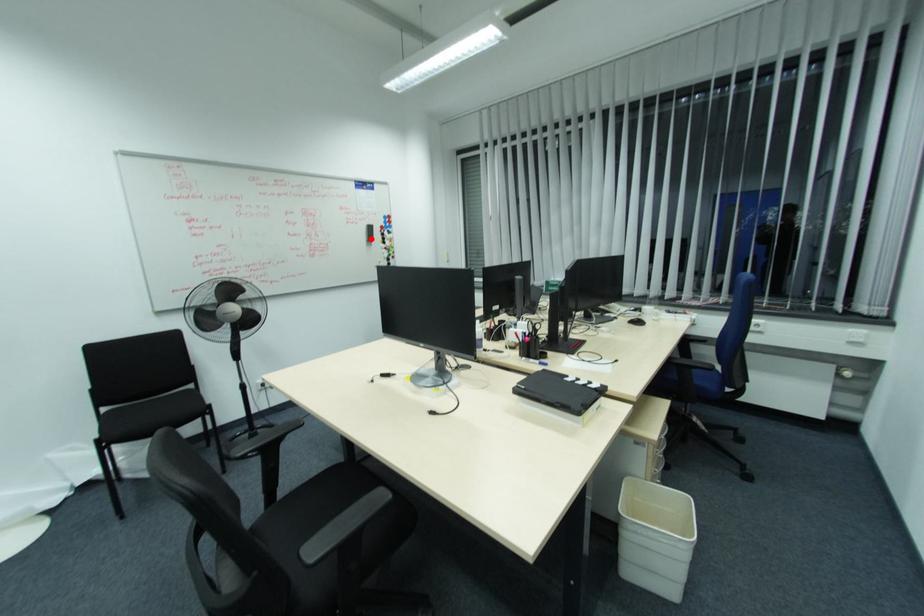
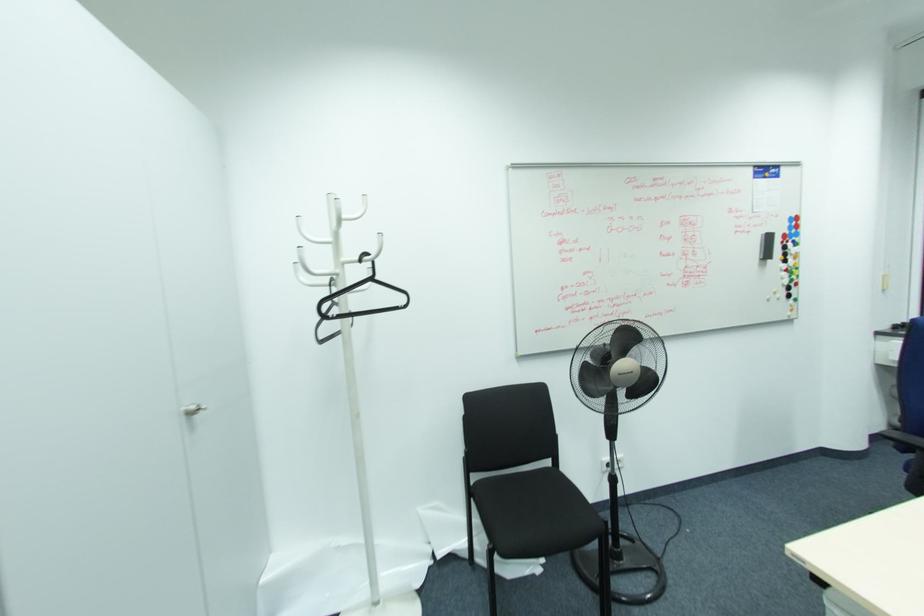
Question: I am providing you with two images of the same scene from different viewpoints. Image1 has a red point marked. In image2, the corresponding 3D location appears at what relative position? Reply with the corresponding letter.

Choices:
 (A) Closer
 (B) Farther

Answer: (B)